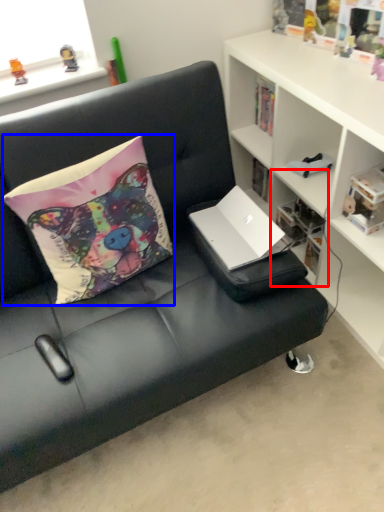
Question: Which of the following is the farthest to the observer, shelf (highlighted by a red box) or pillow (highlighted by a blue box)?

Choices:
 (A) shelf
 (B) pillow

Answer: (A)